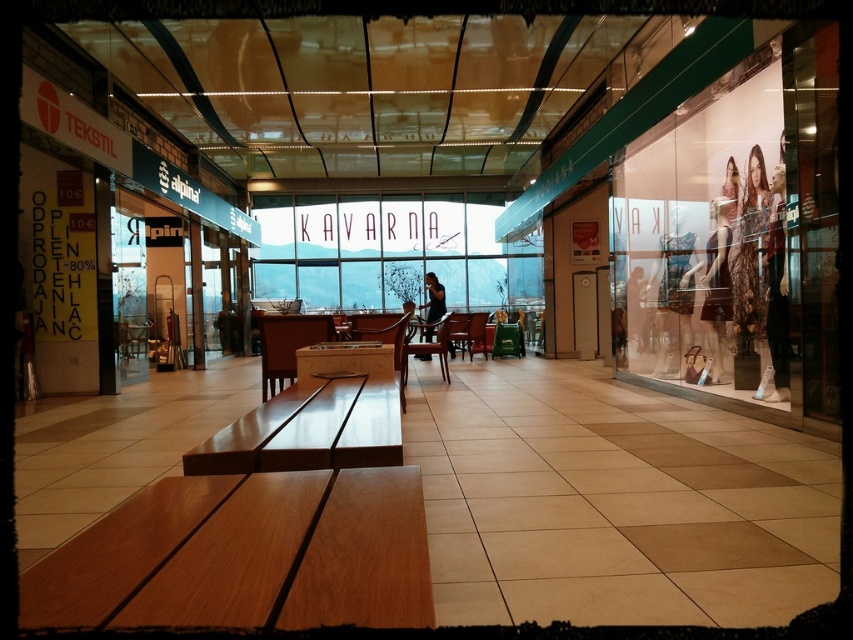
Between wooden bench at lower left and black dress at center, which one appears on the right side from the viewer's perspective?

Positioned to the right is black dress at center.

Is point (99, 531) positioned in front of point (428, 355)?

Yes, it is in front of point (428, 355).

Where is `wooden bench at lower left`? wooden bench at lower left is located at coordinates (245, 556).

Image resolution: width=853 pixels, height=640 pixels. What do you see at coordinates (387, 252) in the screenshot?
I see `transparent glass sign at center` at bounding box center [387, 252].

Between transparent glass sign at center and black dress at center, which one is positioned higher?

Positioned higher is transparent glass sign at center.

Locate an element on the screen. The image size is (853, 640). transparent glass sign at center is located at coordinates (387, 252).

Image resolution: width=853 pixels, height=640 pixels. What do you see at coordinates (245, 556) in the screenshot?
I see `wooden bench at lower left` at bounding box center [245, 556].

Consider the image. Is wooden bench at lower left below transparent glass sign at center?

Yes, wooden bench at lower left is below transparent glass sign at center.

Locate an element on the screen. This screenshot has width=853, height=640. wooden bench at lower left is located at coordinates (245, 556).

Locate an element on the screen. The image size is (853, 640). wooden bench at lower left is located at coordinates (245, 556).